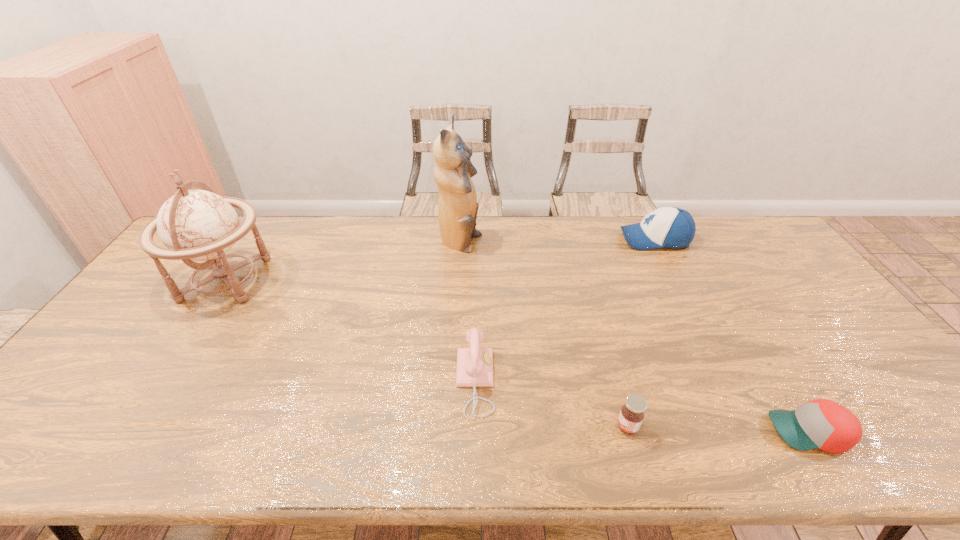
Locate an element on the screen. Image resolution: width=960 pixels, height=540 pixels. free space located 0.380m on the front-facing side of the leftmost object is located at coordinates (394, 279).

Locate an element on the screen. vacant space situated 0.320m on the front-facing side of the farther baseball cap is located at coordinates (529, 239).

Where is `free region located on the front-facing side of the farther baseball cap`? Image resolution: width=960 pixels, height=540 pixels. free region located on the front-facing side of the farther baseball cap is located at coordinates (588, 239).

Find the location of a particular element. Image resolution: width=960 pixels, height=540 pixels. free space located on the front-facing side of the farther baseball cap is located at coordinates (603, 239).

Image resolution: width=960 pixels, height=540 pixels. Find the location of `vacant area situated 0.310m on the dial of the telephone`. vacant area situated 0.310m on the dial of the telephone is located at coordinates (618, 381).

Where is `vacant space situated 0.280m on the label side of the jam`? vacant space situated 0.280m on the label side of the jam is located at coordinates (493, 426).

Where is `free space located on the label side of the jam`? The width and height of the screenshot is (960, 540). free space located on the label side of the jam is located at coordinates (498, 426).

Image resolution: width=960 pixels, height=540 pixels. Find the location of `free space located on the label side of the jam`. free space located on the label side of the jam is located at coordinates (560, 426).

You are a GUI agent. You are given a task and a screenshot of the screen. Output one action in this format:
    pyautogui.click(x=<x>, y=<y>)
    Task: Click on the vacant space located at the brim of the shortest object
    Image resolution: width=960 pixels, height=540 pixels.
    Given the screenshot: What is the action you would take?
    pyautogui.click(x=651, y=431)

This screenshot has width=960, height=540. I want to click on free space located 0.380m at the brim of the shortest object, so click(x=602, y=431).